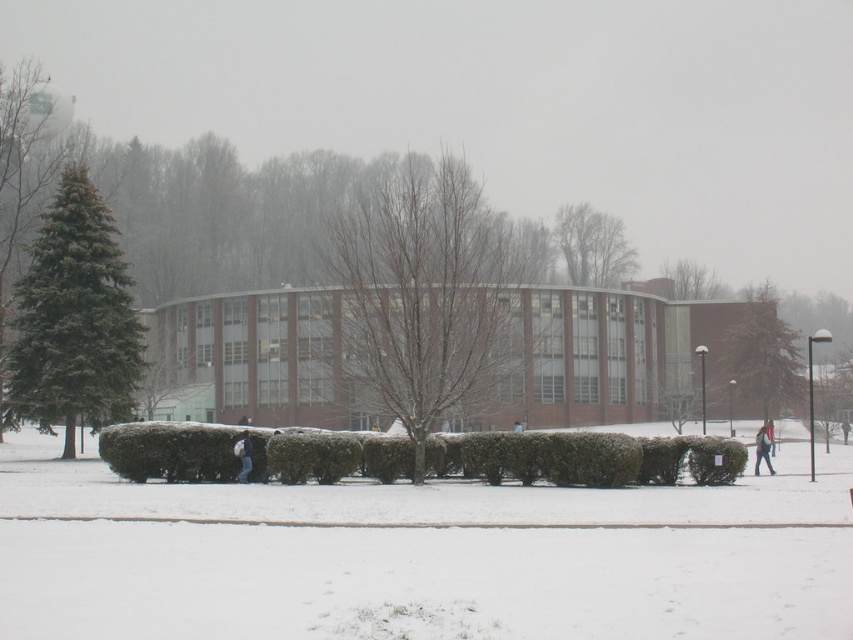
Question: Which point is closer to the camera taking this photo?

Choices:
 (A) (467, 256)
 (B) (706, 296)
 (C) (766, 438)
 (D) (776, 364)

Answer: (A)

Question: Does green textured hedge at center have a smaller size compared to bare branches at upper center?

Choices:
 (A) yes
 (B) no

Answer: (A)

Question: Which object appears closest to the camera in this image?

Choices:
 (A) light blue jeans at lower right
 (B) green textured hedge at center

Answer: (B)

Question: Which object is the closest to the green leafy tree at upper center?

Choices:
 (A) bare branches tree at center
 (B) green textured hedge at center
 (C) dark blue jeans at center

Answer: (A)

Question: Can you confirm if green textured hedge at center is thinner than green leafy tree at upper center?

Choices:
 (A) yes
 (B) no

Answer: (A)

Question: Is bare branches at upper center closer to camera compared to light blue jeans at lower right?

Choices:
 (A) yes
 (B) no

Answer: (B)